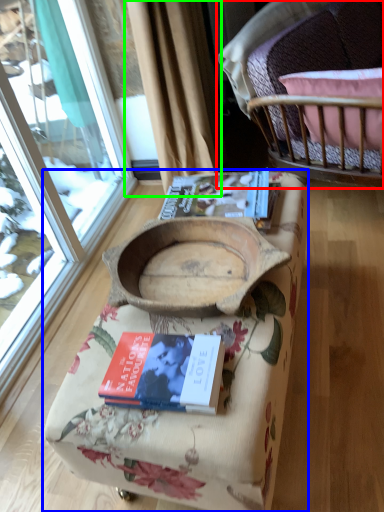
Question: Which object is the closest to the chair (highlighted by a red box)? Choose among these: furniture (highlighted by a blue box) or curtain (highlighted by a green box).

Choices:
 (A) furniture
 (B) curtain

Answer: (B)